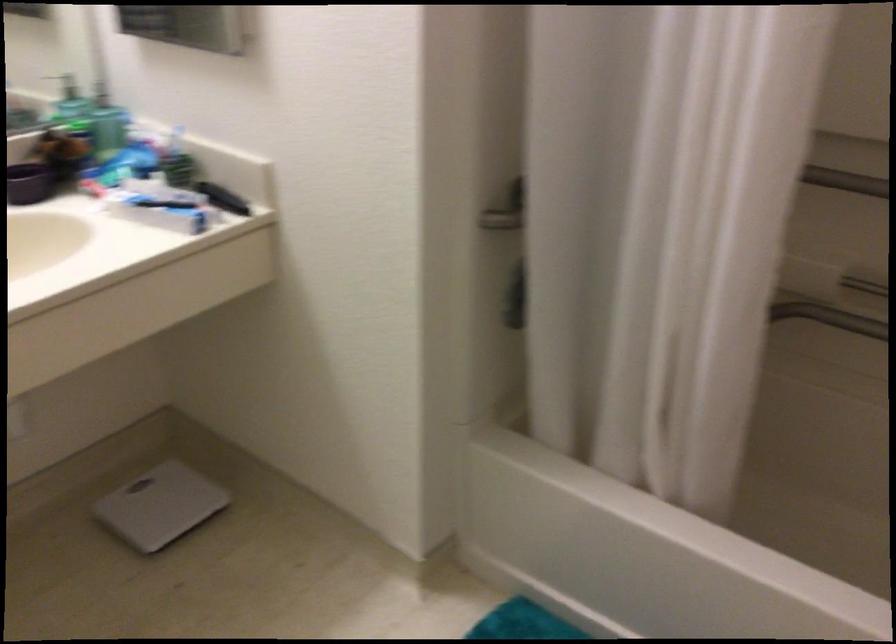
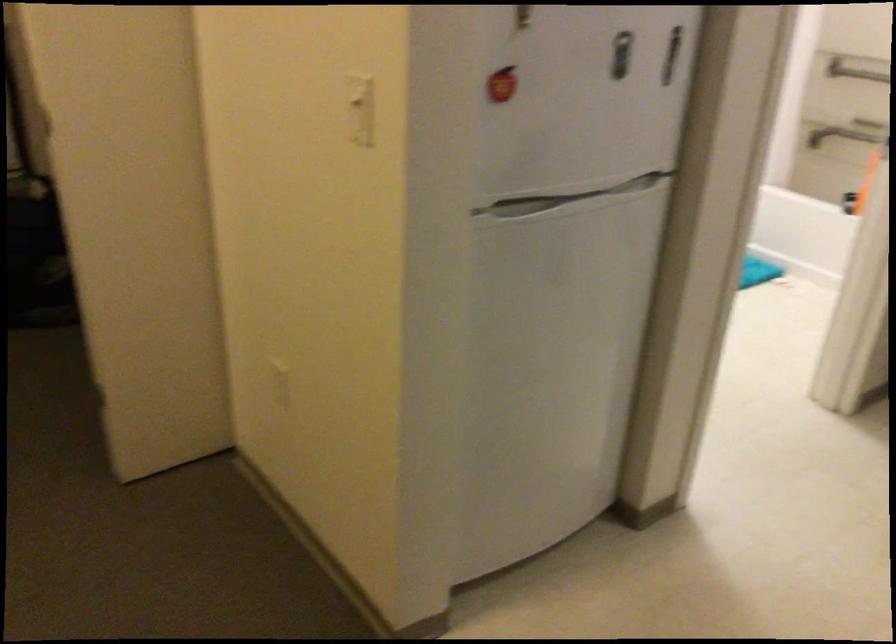
Question: I am providing you with two images of the same scene from different viewpoints. Please identify which objects are invisible in image2.

Choices:
 (A) white bathroom scale
 (B) metal flower bowl
 (C) white light switch
 (D) red apple magnet

Answer: (A)